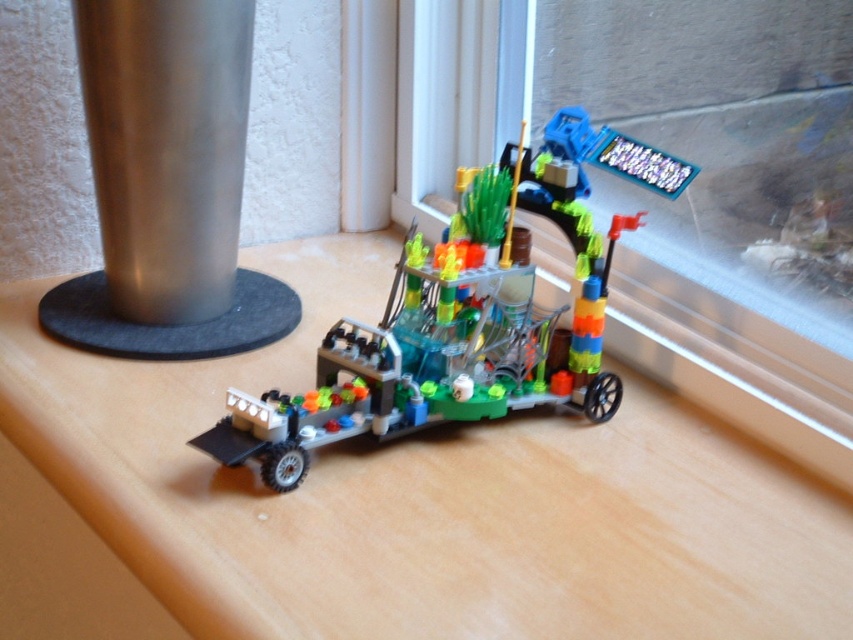
Does wooden table at center appear under transparent plastic window at upper right?

Yes, wooden table at center is below transparent plastic window at upper right.

Who is positioned more to the left, wooden table at center or transparent plastic window at upper right?

wooden table at center is more to the left.

Which is in front, point (764, 492) or point (746, 20)?

Point (764, 492) is more forward.

Locate an element on the screen. The image size is (853, 640). wooden table at center is located at coordinates (398, 502).

Does transparent plastic window at upper right lie in front of translucent plastic vehicle at center?

No, transparent plastic window at upper right is behind translucent plastic vehicle at center.

Looking at this image, who is more distant from viewer, (596, 225) or (471, 353)?

The point (596, 225) is behind.

This screenshot has height=640, width=853. In order to click on transparent plastic window at upper right in this screenshot , I will do `click(677, 157)`.

Is wooden table at center bigger than translucent plastic vehicle at center?

Correct, wooden table at center is larger in size than translucent plastic vehicle at center.

Who is more forward, (x=26, y=339) or (x=466, y=236)?

Point (x=466, y=236) is more forward.

Between point (363, 250) and point (381, 406), which one is positioned in front?

Point (381, 406) is more forward.

Identify the location of wooden table at center. The image size is (853, 640). (398, 502).